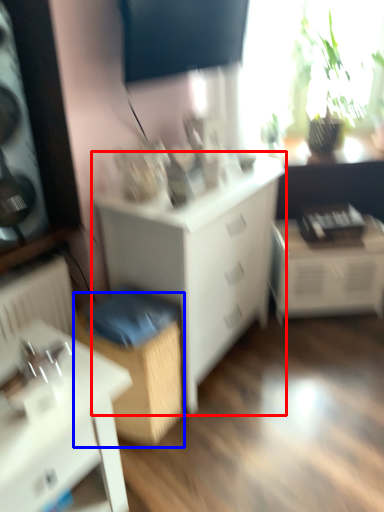
Question: Which object is closer to the camera taking this photo, chest of drawers (highlighted by a red box) or cabinetry (highlighted by a blue box)?

Choices:
 (A) chest of drawers
 (B) cabinetry

Answer: (A)